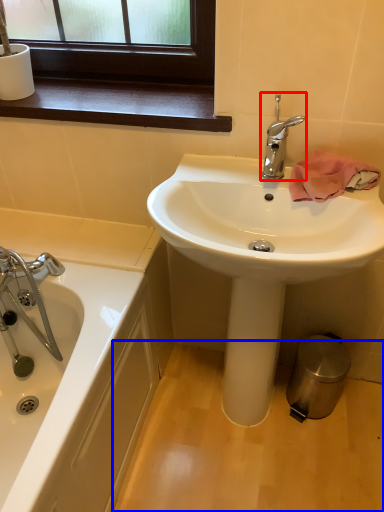
Question: Which of the following is the closest to the observer, tap (highlighted by a red box) or plain (highlighted by a blue box)?

Choices:
 (A) tap
 (B) plain

Answer: (A)